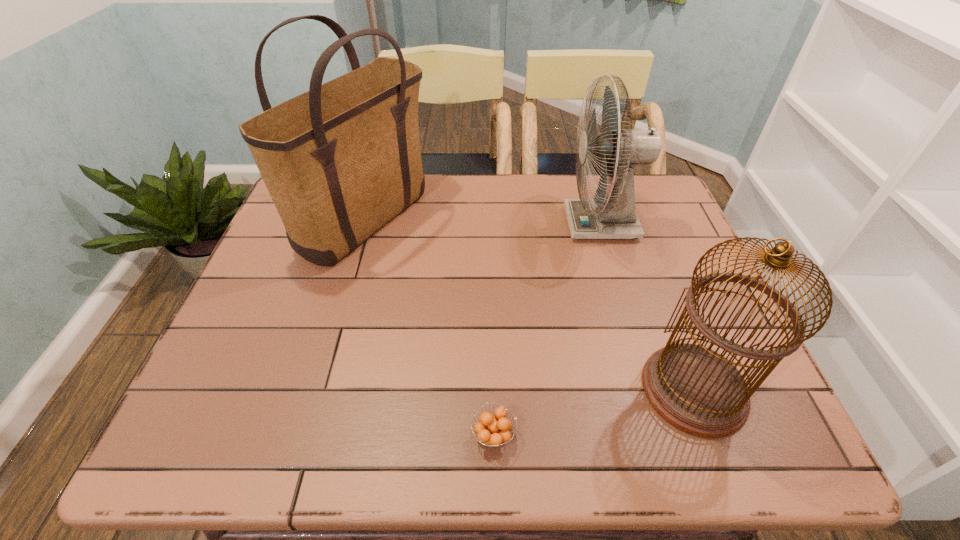
Locate which object ranks in proximity to the third object from right to left. Please provide its 2D coordinates. Your answer should be formatted as a tuple, i.e. [(x, y)], where the tuple contains the x and y coordinates of a point satisfying the conditions above.

[(697, 390)]

Find the location of a particular element. object that is the closest to the fan is located at coordinates (697, 390).

This screenshot has height=540, width=960. Find the location of `blank area in the image that satisfies the following two spatial constraints: 1. on the front side of the orange fruit; 2. on the right side of the tallest object`. blank area in the image that satisfies the following two spatial constraints: 1. on the front side of the orange fruit; 2. on the right side of the tallest object is located at coordinates (306, 435).

Identify the location of blank area in the image that satisfies the following two spatial constraints: 1. on the front-facing side of the birdcage; 2. on the front side of the shortest object. point(710,435).